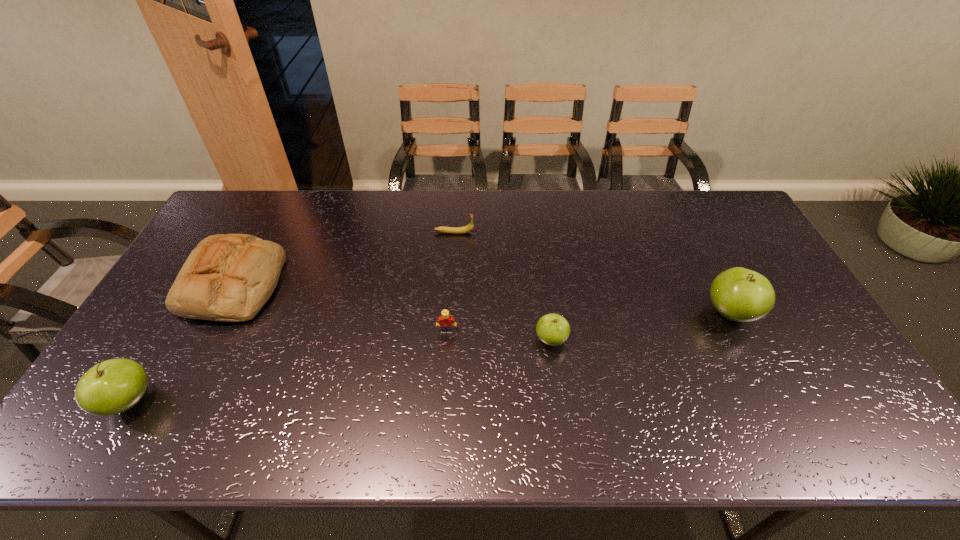
In order to click on vacant space located 0.200m on the back of the rightmost apple in this screenshot , I will do `click(697, 247)`.

You are a GUI agent. You are given a task and a screenshot of the screen. Output one action in this format:
    pyautogui.click(x=<x>, y=<y>)
    Task: Click on the vacant space located on the front of the bread
    The height and width of the screenshot is (540, 960).
    Given the screenshot: What is the action you would take?
    pyautogui.click(x=176, y=399)

Identify the location of vacant space located 0.150m on the front-facing side of the Lego. The width and height of the screenshot is (960, 540). (444, 383).

Find the location of a particular element. The width and height of the screenshot is (960, 540). blank area located 0.380m at the stem of the banana is located at coordinates click(x=586, y=233).

Identify the location of object present at the far edge. This screenshot has height=540, width=960. (451, 230).

Where is `object that is at the near edge`? The image size is (960, 540). object that is at the near edge is located at coordinates tap(111, 387).

At what (x,y) coordinates should I click in order to perform the action: click on apple present at the left edge. Please return your answer as a coordinate pair (x, y). Looking at the image, I should click on (111, 387).

Identify the location of bread at the left edge. The width and height of the screenshot is (960, 540). (229, 278).

What are the coordinates of `object at the right edge` in the screenshot? It's located at (739, 294).

Find the location of a particular element. object present at the near left corner is located at coordinates (111, 387).